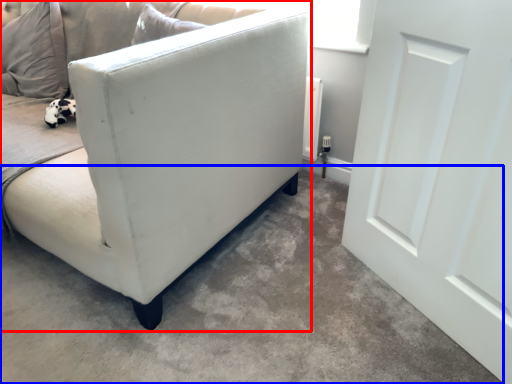
Question: Among these objects, which one is nearest to the camera, studio couch (highlighted by a red box) or concrete (highlighted by a blue box)?

Choices:
 (A) studio couch
 (B) concrete

Answer: (B)